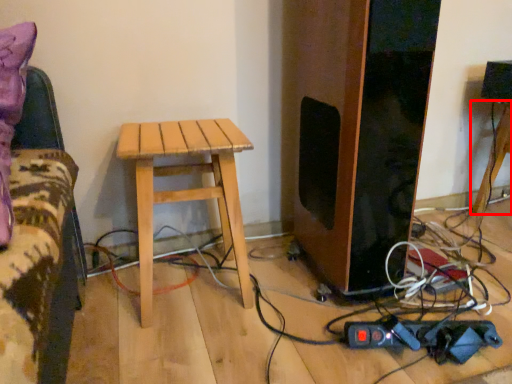
Question: From the image's perspective, where is table (annotated by the red box) located in relation to stool in the image?

Choices:
 (A) below
 (B) above

Answer: (B)